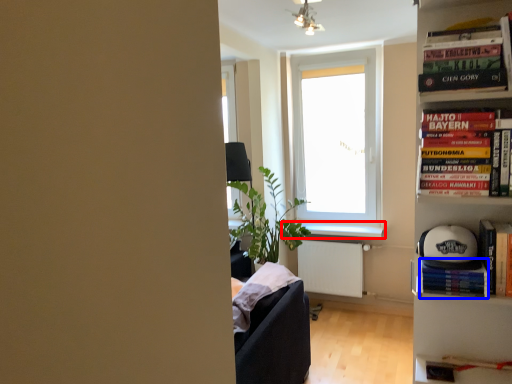
Question: Which object appears closest to the camera in this image, window sill (highlighted by a red box) or paperback book (highlighted by a blue box)?

Choices:
 (A) window sill
 (B) paperback book

Answer: (B)